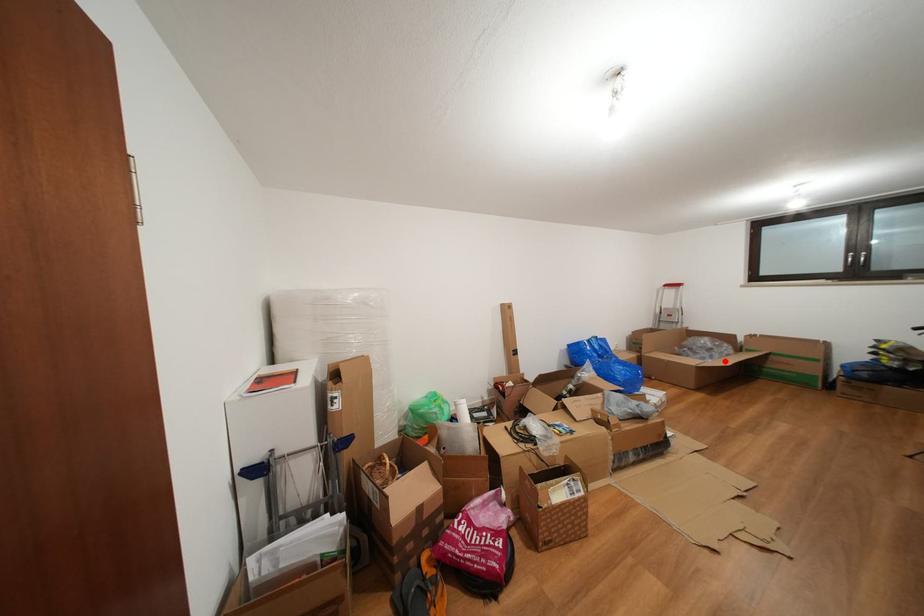
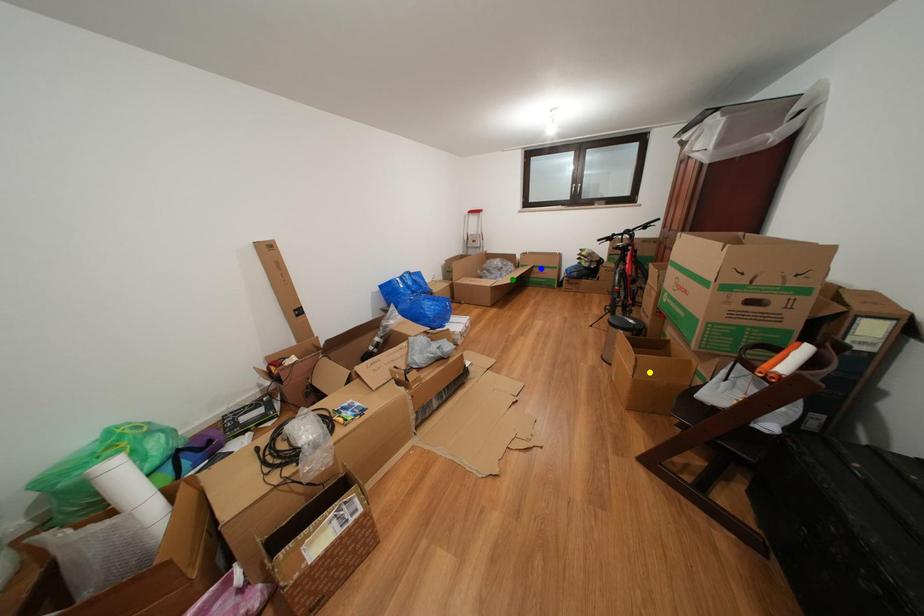
Question: I am providing you with two images of the same scene from different viewpoints. A red point is marked on the first image. You are given multiple points on the second image. Which mark in image 2 goes with the point in image 1?

Choices:
 (A) yellow point
 (B) blue point
 (C) green point

Answer: (C)